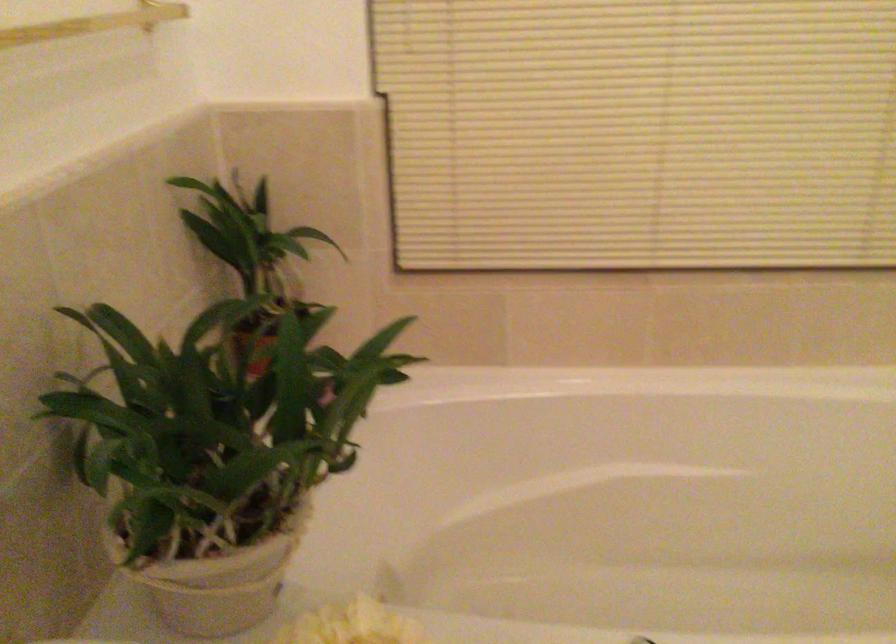
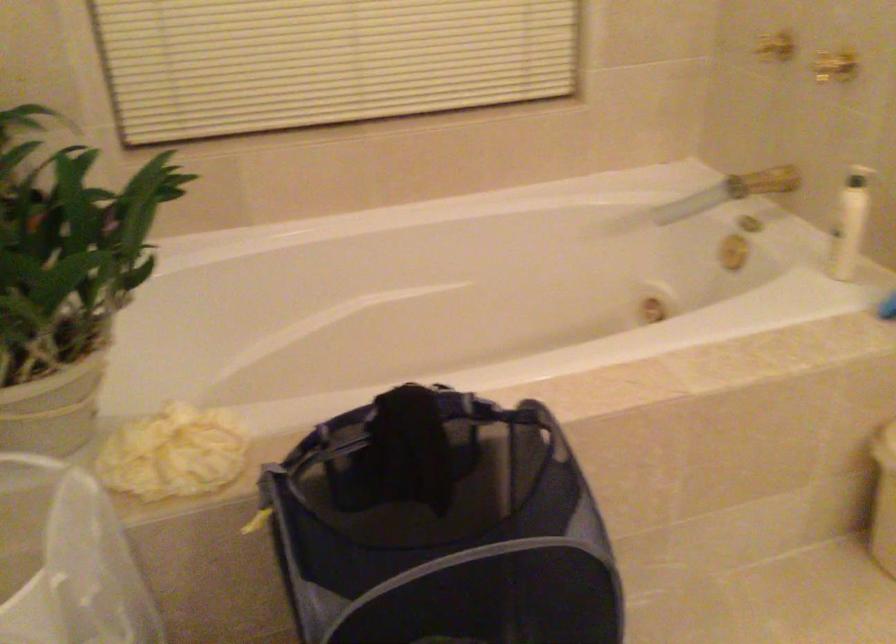
Question: Based on the continuous images, in which direction is the camera rotating? Reply with the corresponding letter.

Choices:
 (A) Left
 (B) Right
 (C) Up
 (D) Down

Answer: (B)